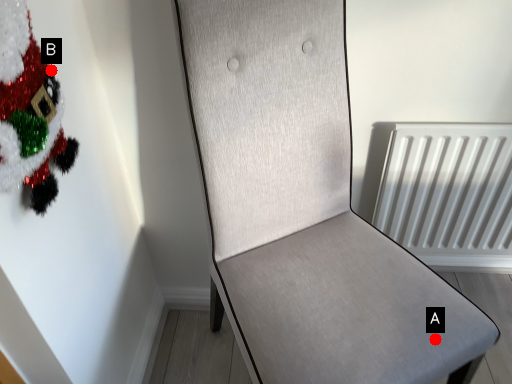
Question: Two points are circled on the image, labeled by A and B beside each circle. Which of the following is the farthest from the observer?

Choices:
 (A) A is further
 (B) B is further

Answer: (A)